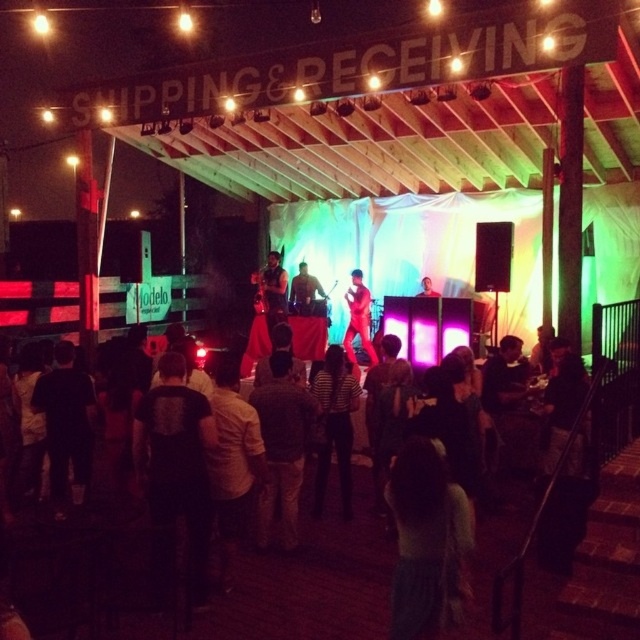
You are at the event and want to find the striped shirt at center. Where should you look?

You should look at point (333, 426) to find the striped shirt at center.

You are organizing a photo shoot for a fashion magazine and need to arrange two models wearing the striped shirt at center and the matte red shirt at center. Based on the scene description, which shirt should be placed in a position that requires more space to accommodate its size?

The striped shirt at center should be placed in a position that requires more space because its width is larger than the matte red shirt at center.